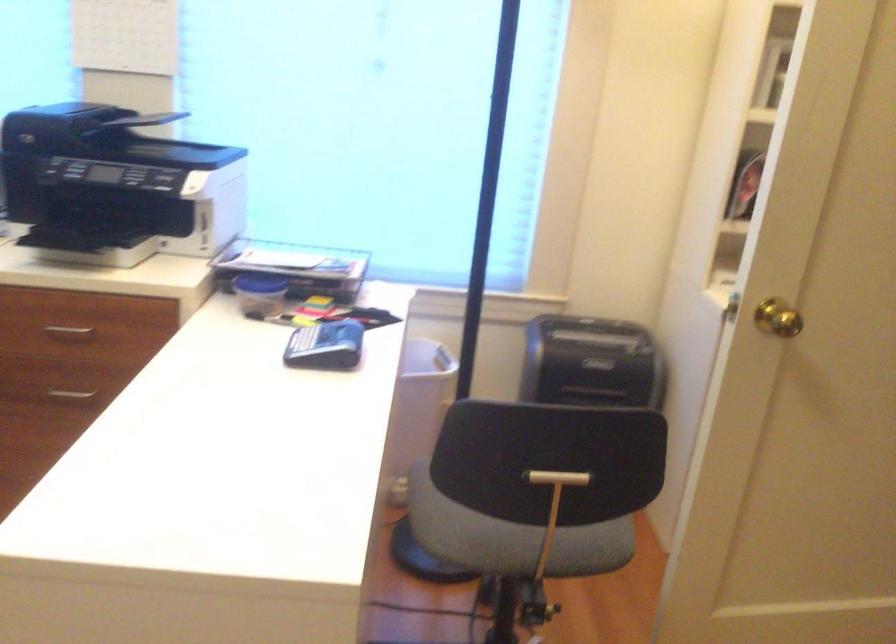
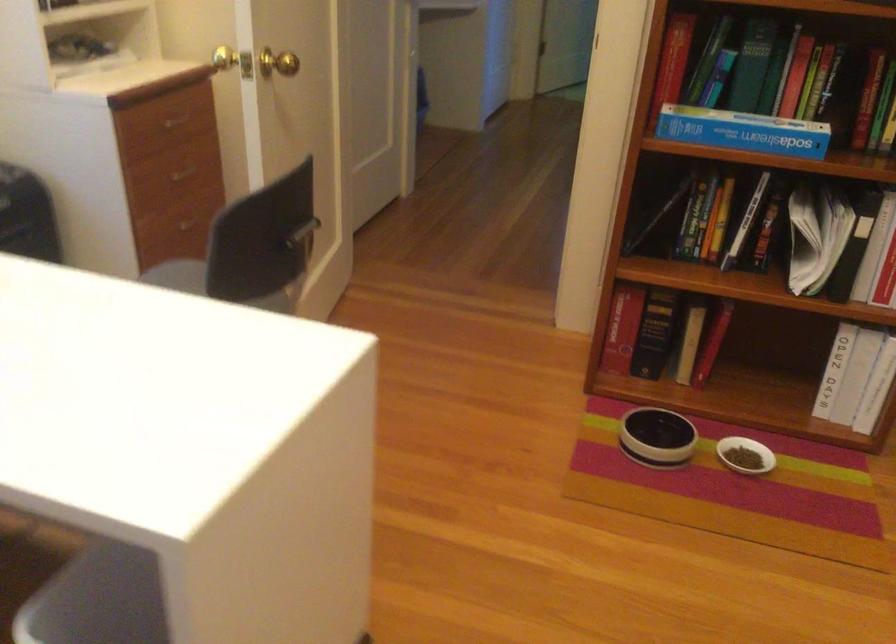
In the second image, find the point that corresponds to (738,301) in the first image.

(233, 61)